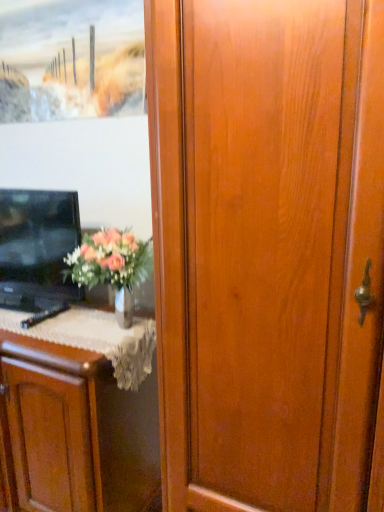
Question: From a real-world perspective, is black glossy tv at left positioned above or below wooden frame at upper left?

Choices:
 (A) below
 (B) above

Answer: (A)

Question: Considering the positions of black glossy tv at left and wooden frame at upper left in the image, is black glossy tv at left taller or shorter than wooden frame at upper left?

Choices:
 (A) tall
 (B) short

Answer: (A)

Question: Which object is positioned farthest from the wooden frame at upper left?

Choices:
 (A) black glossy tv at left
 (B) matte wood cabinet at left

Answer: (B)

Question: Estimate the real-world distances between objects in this image. Which object is closer to the black glossy tv at left?

Choices:
 (A) wooden frame at upper left
 (B) matte wood cabinet at left

Answer: (B)